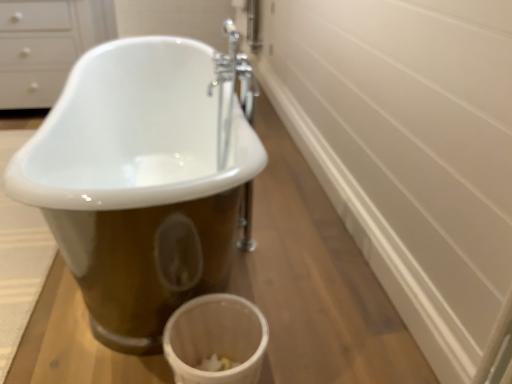
Question: Looking at the image, does white textured bath mat at lower left seem bigger or smaller compared to white glossy drawer at upper left?

Choices:
 (A) big
 (B) small

Answer: (B)

Question: Considering the positions of white textured bath mat at lower left and white glossy drawer at upper left in the image, is white textured bath mat at lower left wider or thinner than white glossy drawer at upper left?

Choices:
 (A) thin
 (B) wide

Answer: (B)

Question: Estimate the real-world distances between objects in this image. Which object is farther from the white porcelain bathtub at center?

Choices:
 (A) white textured bath mat at lower left
 (B) chrome metallic faucet at center
 (C) white matte toilet bowl at lower center
 (D) white glossy drawer at upper left

Answer: (D)

Question: Considering the real-world distances, which object is closest to the white matte toilet bowl at lower center?

Choices:
 (A) white glossy drawer at upper left
 (B) chrome metallic faucet at center
 (C) white textured bath mat at lower left
 (D) white porcelain bathtub at center

Answer: (D)